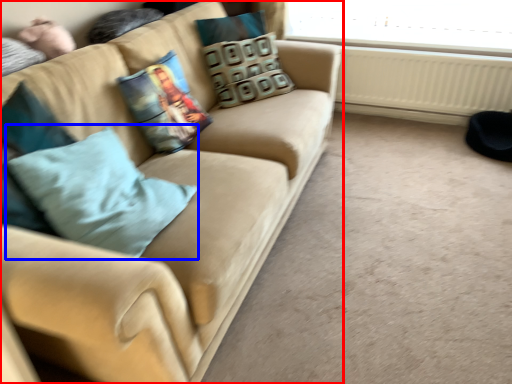
Question: Which object is closer to the camera taking this photo, studio couch (highlighted by a red box) or throw pillow (highlighted by a blue box)?

Choices:
 (A) studio couch
 (B) throw pillow

Answer: (A)